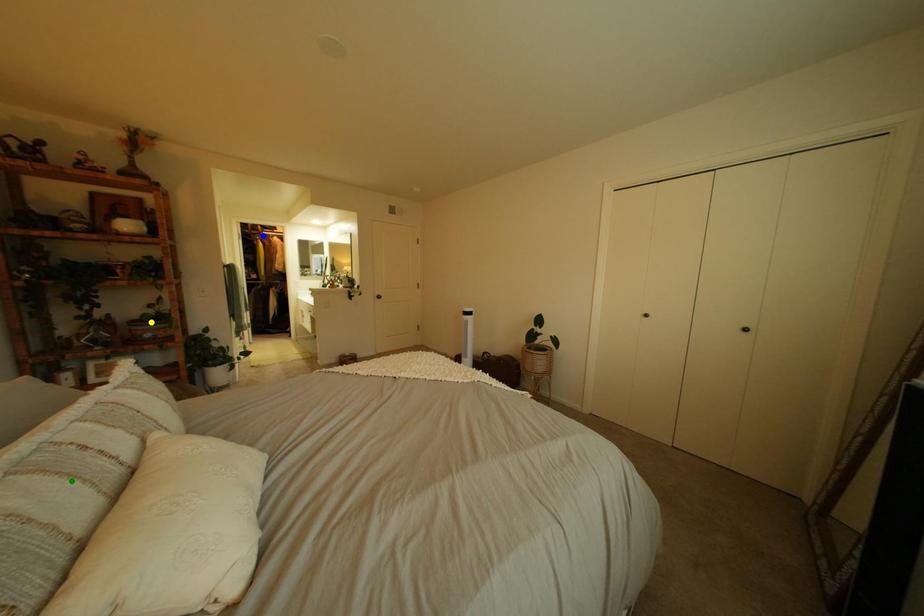
Order these from nearest to farthest:
green point | yellow point | blue point

green point → yellow point → blue point